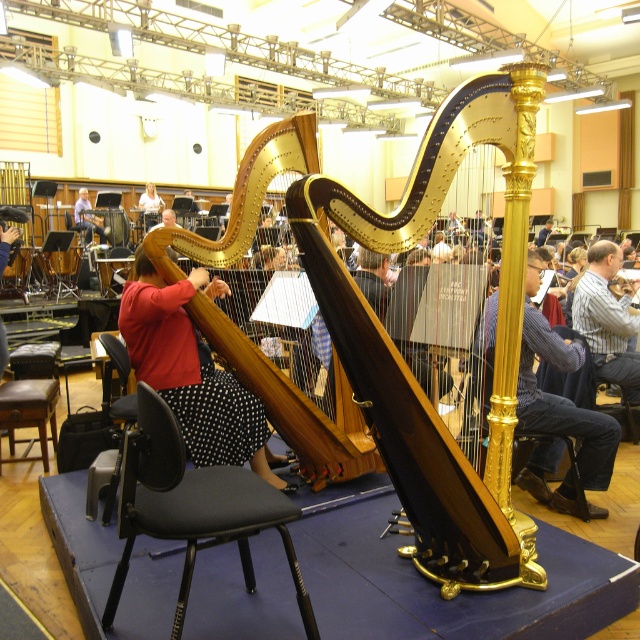
You are a photographer setting up for a group photo in the rehearsal room. You notice two musicians wearing a matte red shirt at center and a striped shirt at center. Which shirt should you adjust the camera focus on if you want to capture the wider one?

The striped shirt at center is wider than the matte red shirt at center, so you should focus the camera on the striped shirt at center to capture the wider one.

You are a photographer setting up for a group photo in the rehearsal room. You need to position the matte red shirt at center and the red fabric dress at center so that both are visible in the frame. Based on their heights, which one should you place closer to the front to ensure both are fully visible?

The matte red shirt at center is much taller than the red fabric dress at center. To ensure both are fully visible in the frame, you should place the red fabric dress at center closer to the front so that the taller matte red shirt at center doesn not block its upper part.

You are a photographer setting up for a group photo in the rehearsal room. You need to place a small tripod between the black fabric chair at center and the matte red shirt at center. Which object should the tripod be closer to if it needs to be placed near the smaller one?

The black fabric chair at center is smaller than the matte red shirt at center, so the tripod should be placed closer to the black fabric chair at center.